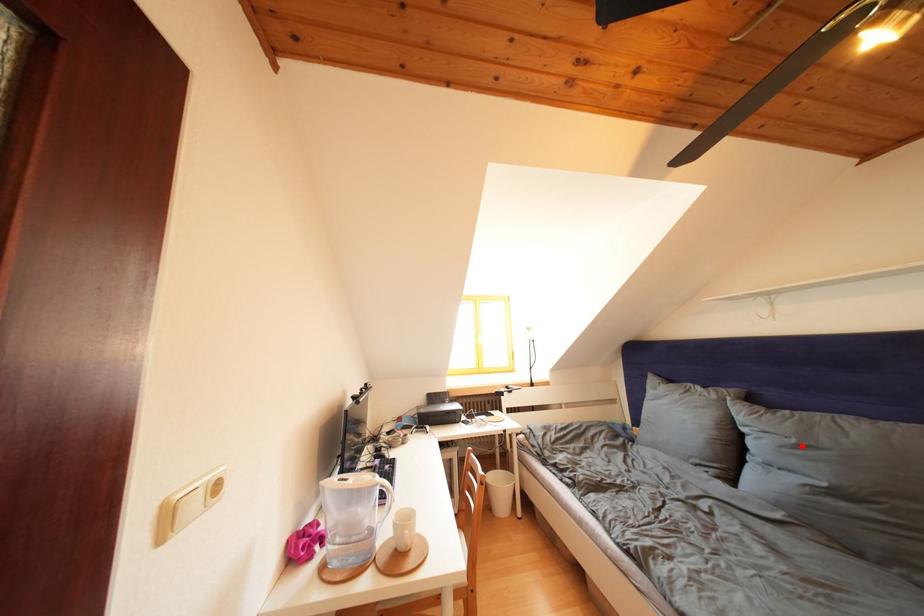
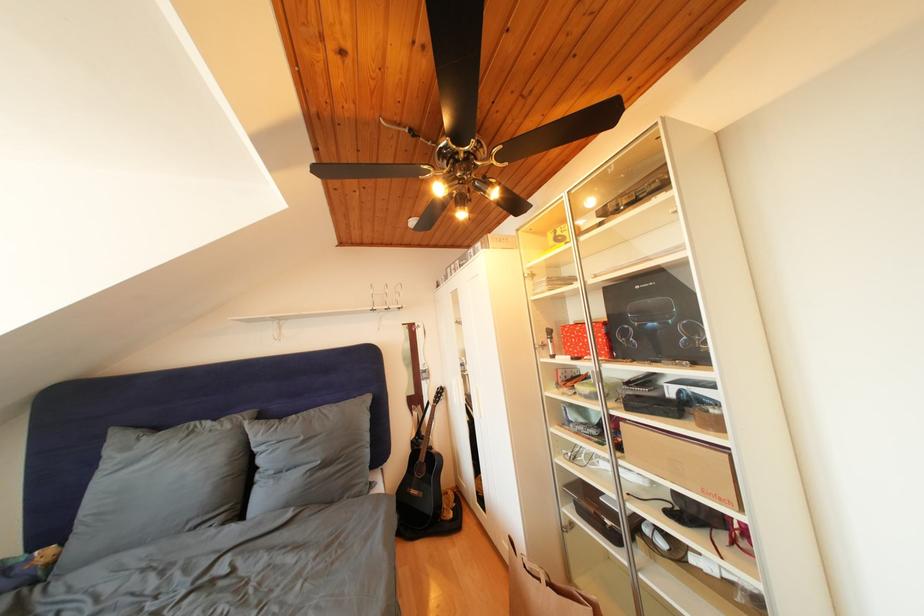
Question: I am providing you with two images of the same scene from different viewpoints. A red point is shown in image1. For the corresponding object point in image2, is it positioned nearer or farther from the camera?

Choices:
 (A) Nearer
 (B) Farther

Answer: (B)